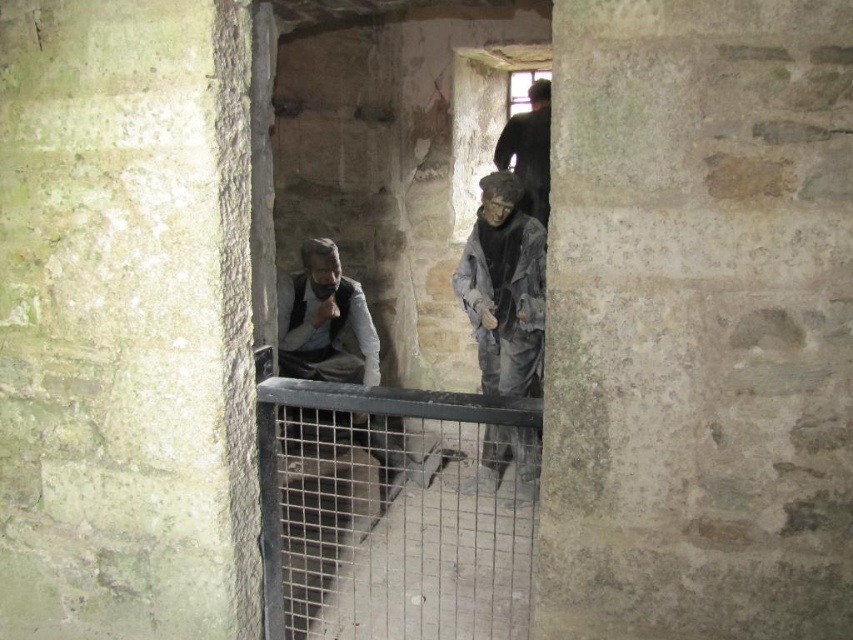
Between stone textured wall at right and metal mesh cage at center, which one appears on the left side from the viewer's perspective?

From the viewer's perspective, metal mesh cage at center appears more on the left side.

Measure the distance between stone textured wall at right and metal mesh cage at center.

stone textured wall at right is 4.04 feet from metal mesh cage at center.

The width and height of the screenshot is (853, 640). Describe the element at coordinates (698, 323) in the screenshot. I see `stone textured wall at right` at that location.

Identify the location of stone textured wall at right. (698, 323).

Which is in front, point (105, 538) or point (302, 618)?

Point (105, 538) is more forward.

The width and height of the screenshot is (853, 640). I want to click on green stone pillar at left, so click(125, 321).

Does stone textured wall at right have a larger size compared to green stone pillar at left?

Incorrect, stone textured wall at right is not larger than green stone pillar at left.

Between point (605, 246) and point (236, 128), which one is positioned behind?

The point (236, 128) is behind.

Locate an element on the screen. stone textured wall at right is located at coordinates (698, 323).